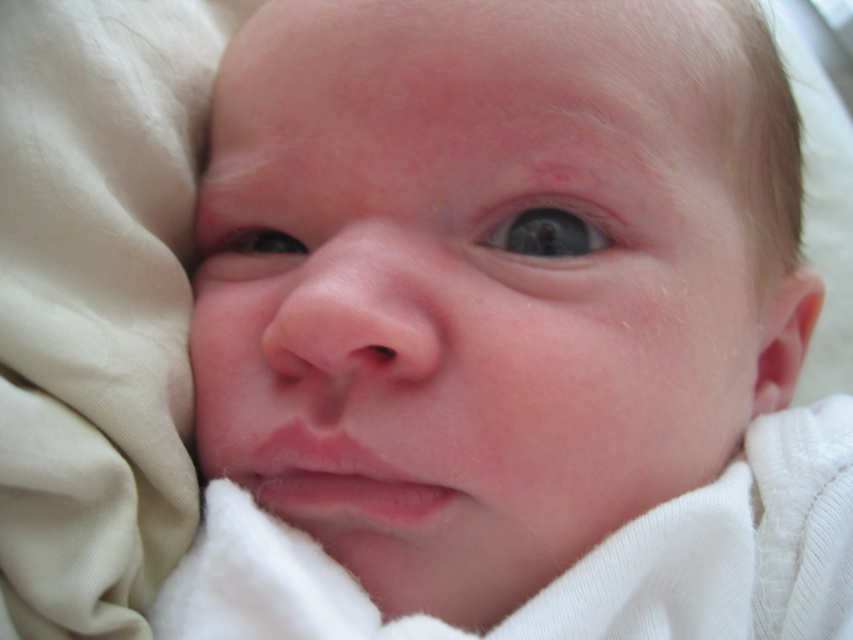
Question: Among these objects, which one is nearest to the camera?

Choices:
 (A) blue glossy eye at center
 (B) smooth skin baby at center

Answer: (B)

Question: Which point is closer to the camera?

Choices:
 (A) (514, 252)
 (B) (247, 234)
 (C) (604, 134)

Answer: (C)

Question: Does smooth skin baby at center have a greater width compared to blue glossy eye at center?

Choices:
 (A) yes
 (B) no

Answer: (A)

Question: Where is smooth skin baby at center located in relation to blue glossy eye at center in the image?

Choices:
 (A) above
 (B) below

Answer: (B)

Question: Is smooth skin baby at center positioned in front of blue glossy eye at center?

Choices:
 (A) no
 (B) yes

Answer: (B)

Question: Among these objects, which one is nearest to the camera?

Choices:
 (A) blue glossy eye at center
 (B) smooth skin baby at center

Answer: (B)